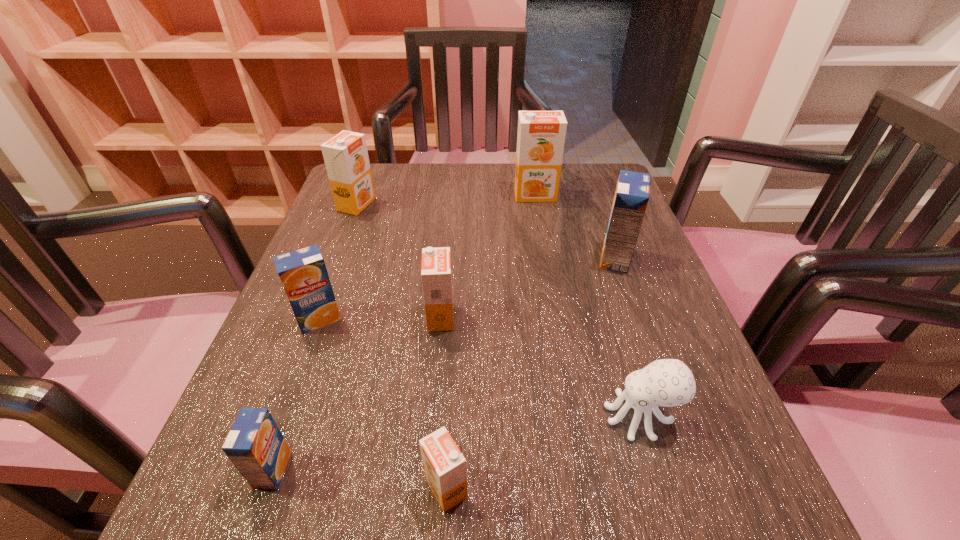
The width and height of the screenshot is (960, 540). What are the coordinates of `free space located on the back of the smallest blue orange_juice` in the screenshot? It's located at (318, 340).

Locate an element on the screen. Image resolution: width=960 pixels, height=540 pixels. orange_juice that is at the right edge is located at coordinates (631, 197).

The height and width of the screenshot is (540, 960). Identify the location of octopus that is at the right edge. (667, 382).

Locate an element on the screen. object located in the far left corner section of the desktop is located at coordinates (346, 158).

Find the location of a particular element. This screenshot has height=540, width=960. object that is at the near left corner is located at coordinates (255, 445).

This screenshot has width=960, height=540. I want to click on vacant space at the far edge of the desktop, so click(453, 174).

In the image, there is a desktop. Where is `free space at the near edge`? The height and width of the screenshot is (540, 960). free space at the near edge is located at coordinates (505, 483).

At what (x,y) coordinates should I click in order to perform the action: click on vacant space at the left edge of the desktop. Please return your answer as a coordinate pair (x, y). This screenshot has height=540, width=960. Looking at the image, I should click on (340, 226).

Image resolution: width=960 pixels, height=540 pixels. Find the location of `free location at the right edge of the desktop`. free location at the right edge of the desktop is located at coordinates (625, 426).

The height and width of the screenshot is (540, 960). Find the location of `free space that is in between the second nearest orange orange juice and the second smallest blue orange_juice`. free space that is in between the second nearest orange orange juice and the second smallest blue orange_juice is located at coordinates (380, 318).